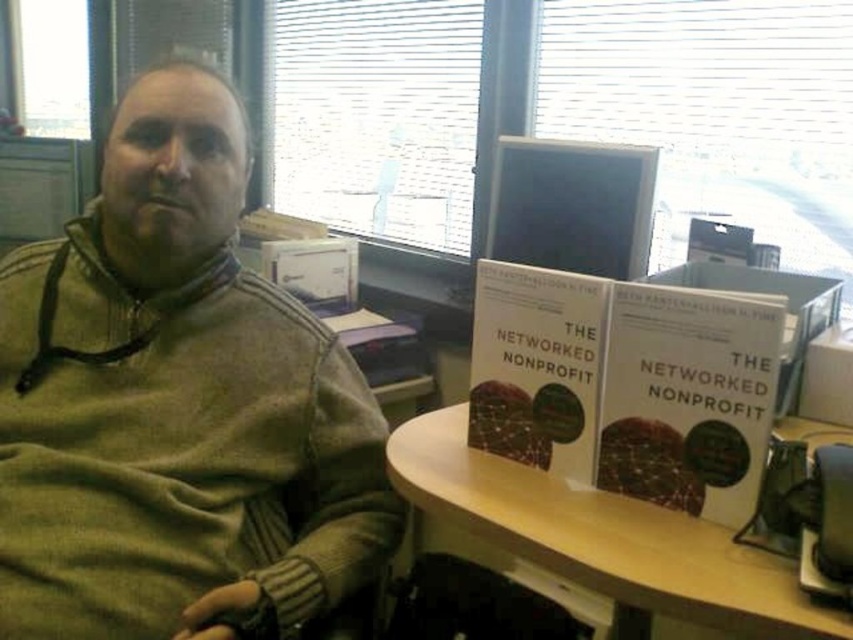
You are an interior designer assessing the office layout. The green knitwear at center and white matte book at center are both on the table. Which object is positioned higher relative to the other?

The green knitwear at center is located above the white matte book at center, so it is positioned higher.

You are a photographer taking a closeup shot of the white matte book at center and the matte plastic computer monitor at upper center. Which object should you focus on first to ensure it appears sharp in the photo?

The white matte book at center is closer to the viewer than the matte plastic computer monitor at upper center, so you should focus on the white matte book at center first to ensure it appears sharp.

You are organizing a bookshelf and need to place the white matte book at center. According to the image, where exactly should you position it relative to the other objects on the table?

The white matte book at center should be placed at the coordinates point (625, 385) as specified in the description.